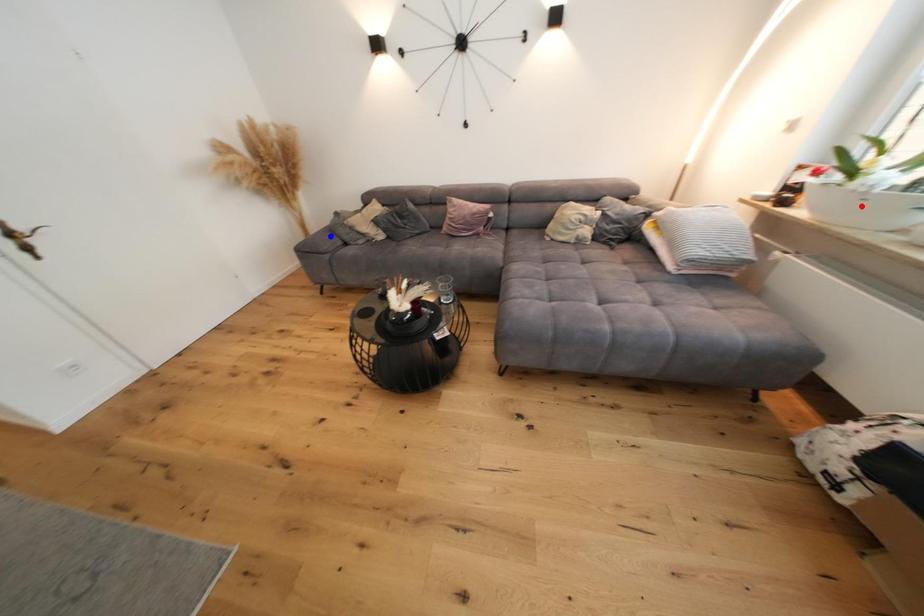
Question: In the image, two points are highlighted. Which point is nearer to the camera? Reply with the corresponding letter.

Choices:
 (A) blue point
 (B) red point

Answer: (B)